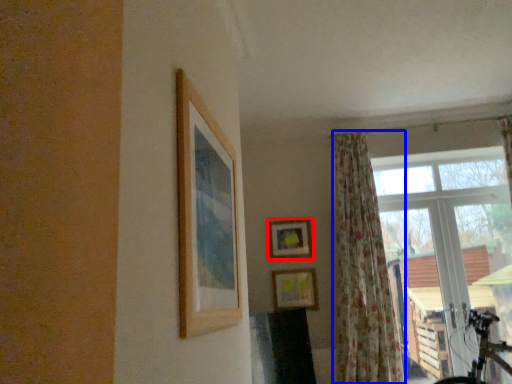
Question: Which of the following is the closest to the observer, picture frame (highlighted by a red box) or curtain (highlighted by a blue box)?

Choices:
 (A) picture frame
 (B) curtain

Answer: (B)